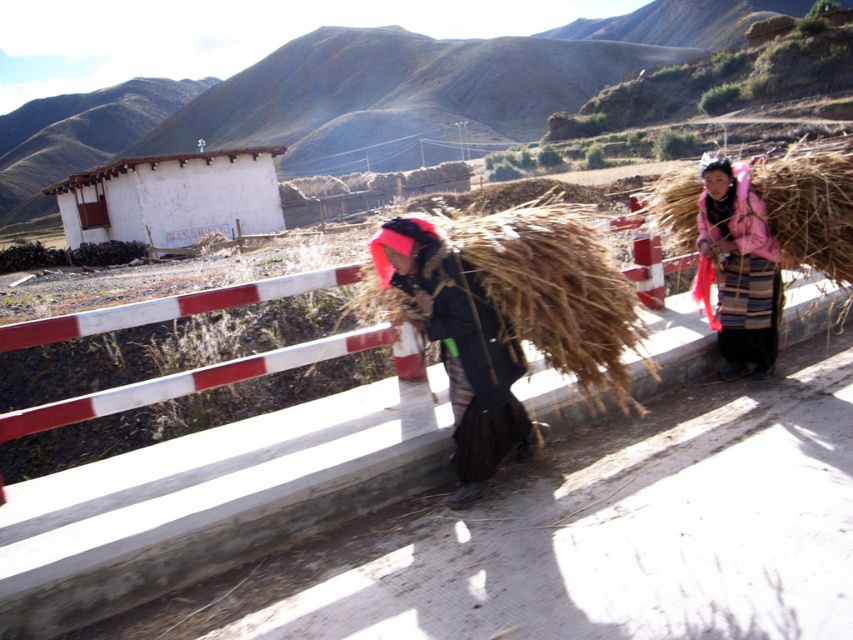
Does dark brown fabric at center appear under white painted wood hut at upper left?

Yes, dark brown fabric at center is below white painted wood hut at upper left.

Between point (482, 392) and point (171, 221), which one is positioned in front?

Point (482, 392) is in front.

Find the location of `dark brown fabric at center`. dark brown fabric at center is located at coordinates tap(459, 348).

Which is behind, point (373, 241) or point (769, 362)?

The point (769, 362) is more distant.

Where is `dark brown fabric at center`? This screenshot has height=640, width=853. dark brown fabric at center is located at coordinates (459, 348).

You are a GUI agent. You are given a task and a screenshot of the screen. Output one action in this format:
    pyautogui.click(x=<x>, y=<y>)
    Task: Click on the dark brown fabric at center
    The image size is (853, 640).
    Given the screenshot: What is the action you would take?
    pyautogui.click(x=459, y=348)

Can you confirm if brown straw at right is wider than pink woolen jacket at right?

Yes, brown straw at right is wider than pink woolen jacket at right.

Can you confirm if brown straw at right is bigger than pink woolen jacket at right?

Yes, brown straw at right is bigger than pink woolen jacket at right.

Who is more distant from viewer, (839, 275) or (721, 236)?

Point (721, 236)

You are a GUI agent. You are given a task and a screenshot of the screen. Output one action in this format:
    pyautogui.click(x=<x>, y=<y>)
    Task: Click on the brown straw at right
    
    Given the screenshot: What is the action you would take?
    pyautogui.click(x=809, y=208)